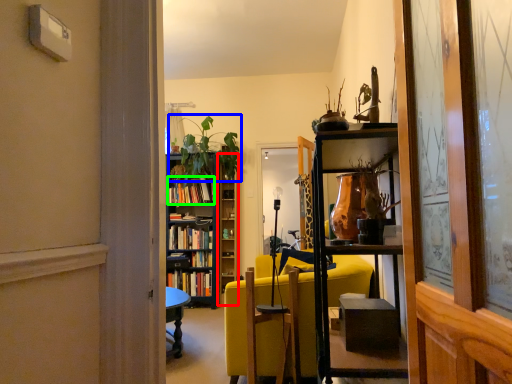
Question: Which is nearer to the bookshelf (highlighted by a red box)? houseplant (highlighted by a blue box) or book (highlighted by a green box).

Choices:
 (A) houseplant
 (B) book

Answer: (A)